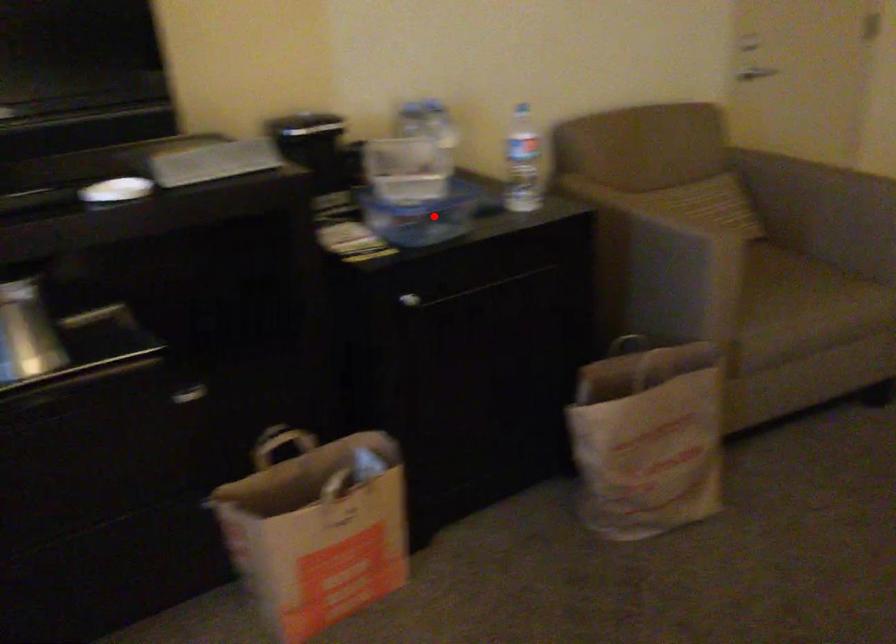
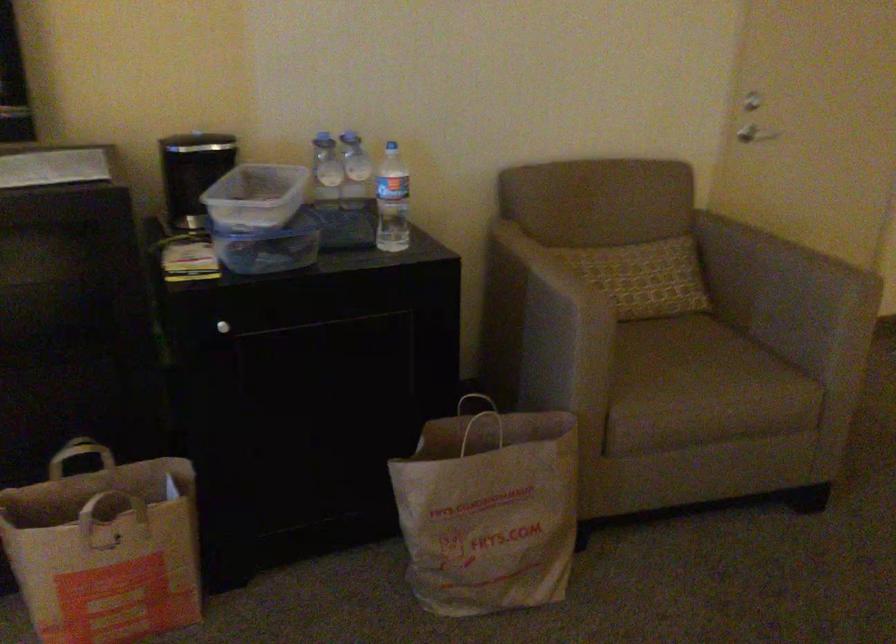
Question: I am providing you with two images of the same scene from different viewpoints. A red point is marked on the first image. Is the red point's position out of view in image 2?

Choices:
 (A) Yes
 (B) No

Answer: (B)